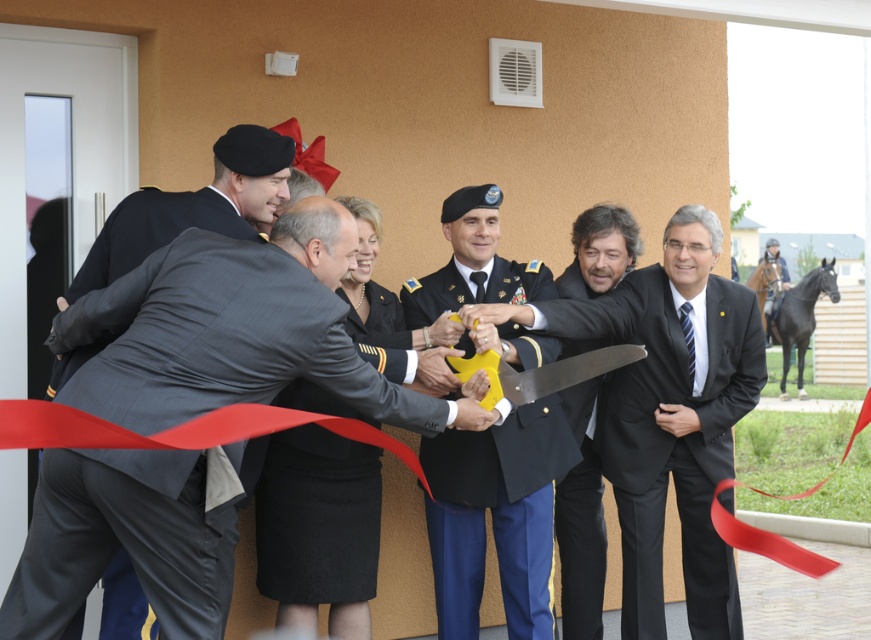
Between matte gray suit at center and matte black suit at left, which one is positioned lower?

matte gray suit at center

Does matte gray suit at center appear under matte black suit at left?

Correct, matte gray suit at center is located below matte black suit at left.

The width and height of the screenshot is (871, 640). In order to click on matte gray suit at center in this screenshot , I will do `click(234, 330)`.

Does uniformed military officer at center appear on the left side of red fabric ribbon at center?

Correct, you'll find uniformed military officer at center to the left of red fabric ribbon at center.

Is uniformed military officer at center bigger than red fabric ribbon at center?

Yes, uniformed military officer at center is bigger than red fabric ribbon at center.

Which is behind, point (504, 556) or point (721, 528)?

Positioned behind is point (504, 556).

You are a GUI agent. You are given a task and a screenshot of the screen. Output one action in this format:
    pyautogui.click(x=<x>, y=<y>)
    Task: Click on the uniformed military officer at center
    The width and height of the screenshot is (871, 640).
    Given the screenshot: What is the action you would take?
    pyautogui.click(x=496, y=516)

Is matte black suit at center in front of matte black suit at left?

No, matte black suit at center is behind matte black suit at left.

Which is in front, point (673, 248) or point (215, 172)?

Point (215, 172)

You are a GUI agent. You are given a task and a screenshot of the screen. Output one action in this format:
    pyautogui.click(x=<x>, y=<y>)
    Task: Click on the matte black suit at center
    This screenshot has height=640, width=871.
    Given the screenshot: What is the action you would take?
    pyautogui.click(x=669, y=416)